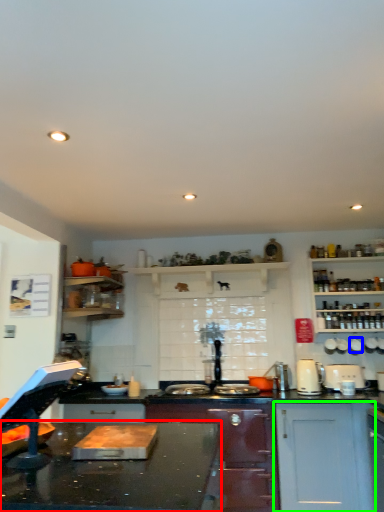
Question: Considering the real-world distances, which object is closest to countertop (highlighted by a red box)? appliance (highlighted by a blue box) or cabinetry (highlighted by a green box).

Choices:
 (A) appliance
 (B) cabinetry

Answer: (B)